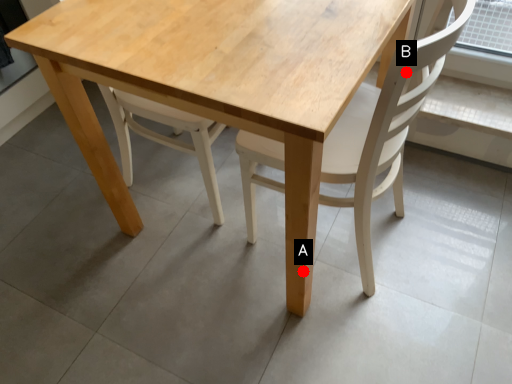
Question: Two points are circled on the image, labeled by A and B beside each circle. Which point is farther from the camera taking this photo?

Choices:
 (A) A is further
 (B) B is further

Answer: (A)